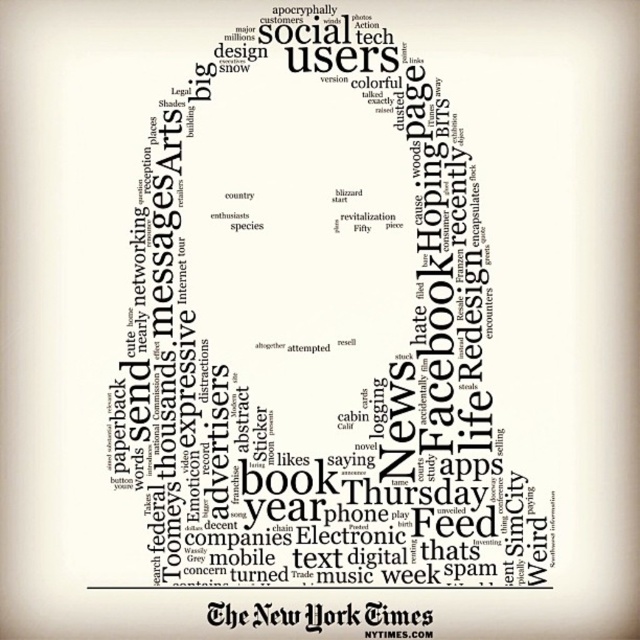
Is white paper at center bigger than black paper at bottom?

Yes.

Does white paper at center have a lesser height compared to black paper at bottom?

Incorrect, white paper at center's height does not fall short of black paper at bottom's.

Between point (388, 465) and point (426, 625), which one is positioned behind?

Point (388, 465)

Where is `white paper at center`? This screenshot has height=640, width=640. white paper at center is located at coordinates (316, 326).